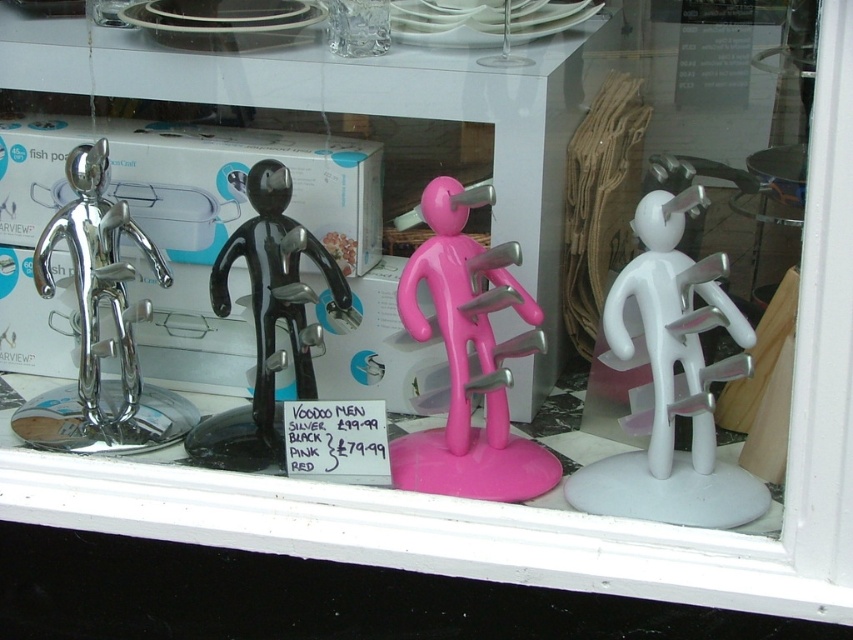
Between pink glossy mannequin at center and polished silver mannequin at left, which one is positioned lower?

pink glossy mannequin at center is below.

Can you confirm if pink glossy mannequin at center is positioned above polished silver mannequin at left?

No, pink glossy mannequin at center is not above polished silver mannequin at left.

Does point (405, 301) lie behind point (122, 211)?

No.

In order to click on pink glossy mannequin at center in this screenshot , I will do `click(468, 358)`.

In the scene shown: Who is more forward, (648, 432) or (109, 300)?

Point (648, 432)

Image resolution: width=853 pixels, height=640 pixels. I want to click on white plastic figure at center, so 672,384.

Where is `pink glossy mannequin at center`? This screenshot has width=853, height=640. pink glossy mannequin at center is located at coordinates (468, 358).

Who is shorter, pink glossy mannequin at center or black glossy voodoo man at center?

With less height is black glossy voodoo man at center.

What do you see at coordinates (468, 358) in the screenshot? The image size is (853, 640). I see `pink glossy mannequin at center` at bounding box center [468, 358].

This screenshot has height=640, width=853. In order to click on pink glossy mannequin at center in this screenshot , I will do `click(468, 358)`.